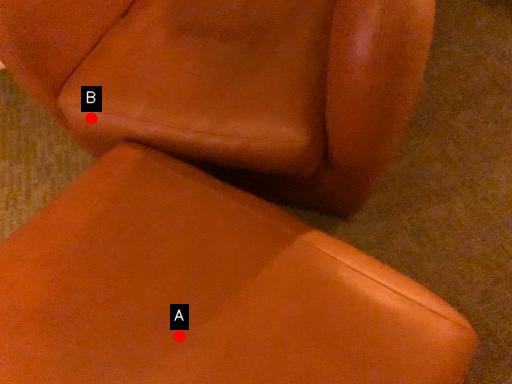
Question: Two points are circled on the image, labeled by A and B beside each circle. Which point is closer to the camera?

Choices:
 (A) A is closer
 (B) B is closer

Answer: (A)